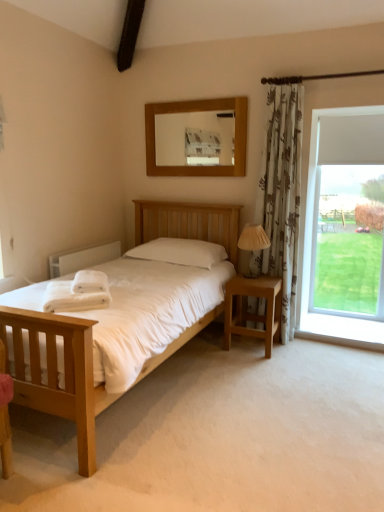
Where is `vacant region below wooden mirror at upper center (from a real-world perspective)`? Image resolution: width=384 pixels, height=512 pixels. vacant region below wooden mirror at upper center (from a real-world perspective) is located at coordinates (198, 196).